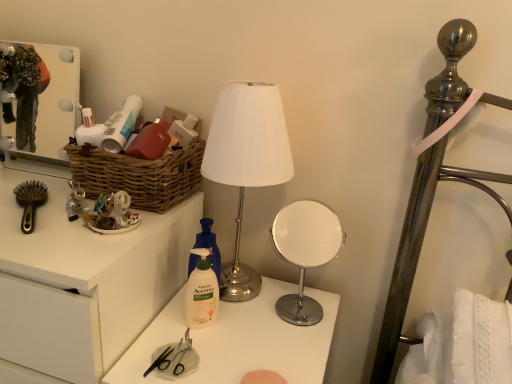
Where is `vacant area that lies to the right of metallic silver scissors at center`? Image resolution: width=512 pixels, height=384 pixels. vacant area that lies to the right of metallic silver scissors at center is located at coordinates (250, 351).